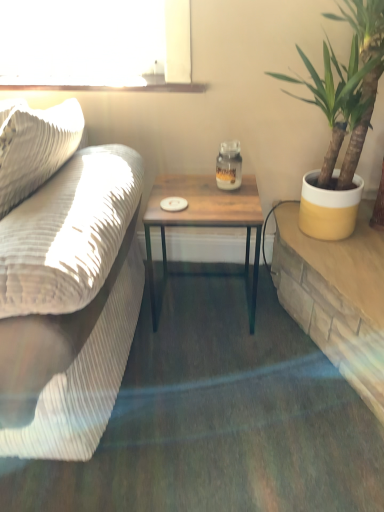
You are a GUI agent. You are given a task and a screenshot of the screen. Output one action in this format:
    pyautogui.click(x=<x>, y=<y>)
    Task: Click on the vacant region to the left of matte glass jar at center
    The image size is (384, 512).
    Given the screenshot: What is the action you would take?
    pyautogui.click(x=187, y=188)